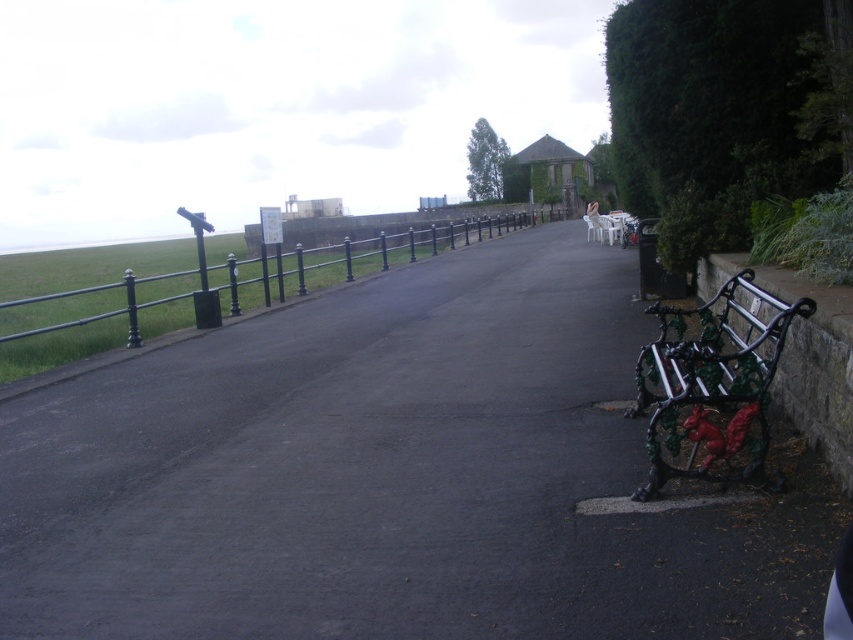
Question: Does black wrought iron bench at lower right appear under black metal fence at left?

Choices:
 (A) yes
 (B) no

Answer: (A)

Question: Which of these objects is positioned farthest from the black asphalt pavement at center?

Choices:
 (A) black metal fence at left
 (B) black wrought iron bench at lower right

Answer: (A)

Question: Can you confirm if black asphalt pavement at center is positioned to the right of black metal fence at left?

Choices:
 (A) no
 (B) yes

Answer: (B)

Question: Is black wrought iron bench at lower right below black metal fence at left?

Choices:
 (A) no
 (B) yes

Answer: (B)

Question: Estimate the real-world distances between objects in this image. Which object is farther from the black wrought iron bench at lower right?

Choices:
 (A) black metal fence at left
 (B) black asphalt pavement at center

Answer: (A)

Question: Which point is closer to the camera?

Choices:
 (A) (581, 529)
 (B) (57, 353)

Answer: (A)